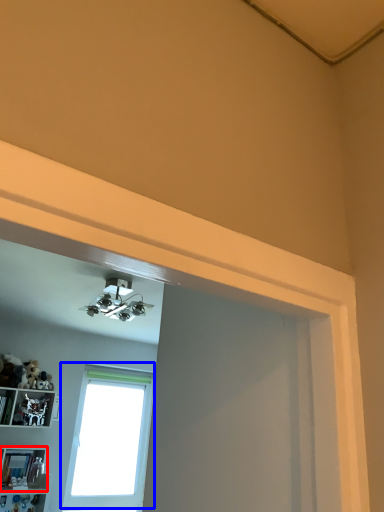
Question: Which object is further to the camera taking this photo, shelf (highlighted by a red box) or window (highlighted by a blue box)?

Choices:
 (A) shelf
 (B) window

Answer: (B)